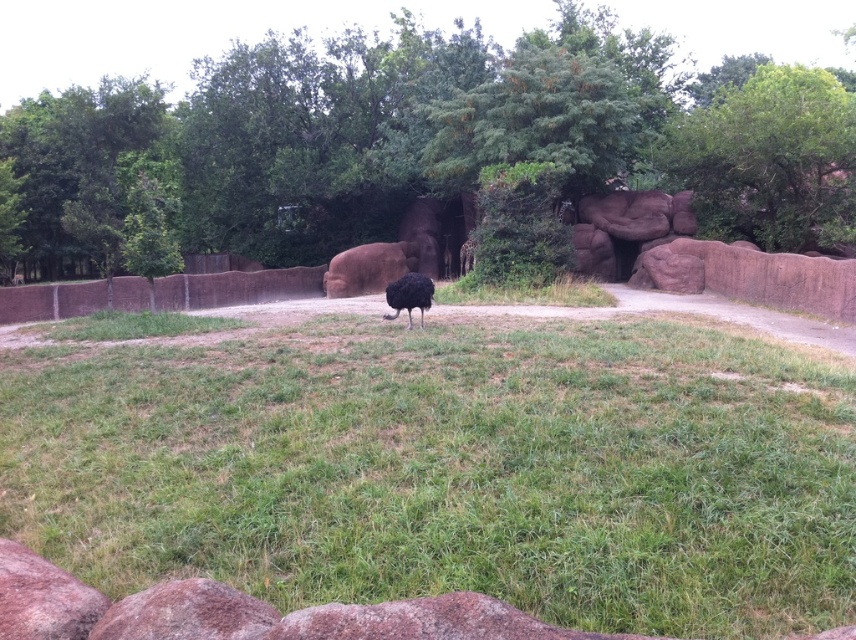
Question: Can you confirm if green leafy tree at upper left is positioned to the right of brown textured fence at left?

Choices:
 (A) yes
 (B) no

Answer: (B)

Question: Which point appears closest to the camera in this image?

Choices:
 (A) pyautogui.click(x=819, y=392)
 (B) pyautogui.click(x=413, y=291)
 (C) pyautogui.click(x=230, y=292)
 (D) pyautogui.click(x=596, y=637)

Answer: (D)

Question: Which point is closer to the camera?

Choices:
 (A) black feathered ostrich at center
 (B) smooth brown rock at lower center
 (C) brown textured fence at left

Answer: (B)

Question: Is rustic stone at lower left smaller than black feathered ostrich at center?

Choices:
 (A) no
 (B) yes

Answer: (B)

Question: Which object is positioned farthest from the green leafy tree at upper right?

Choices:
 (A) green leafy tree at upper left
 (B) green grassy at center

Answer: (A)

Question: Is smooth brown rock at lower center thinner than black feathered ostrich at center?

Choices:
 (A) yes
 (B) no

Answer: (B)